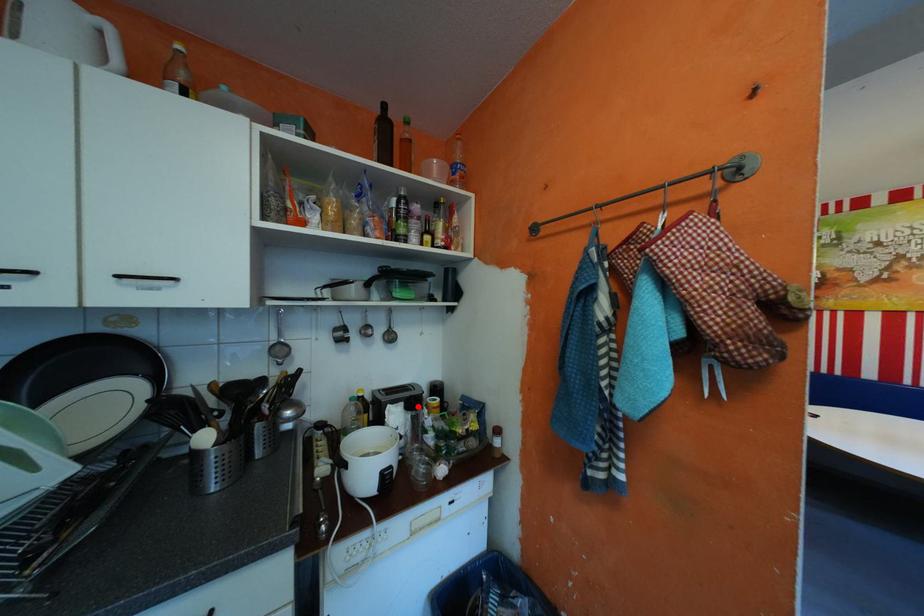
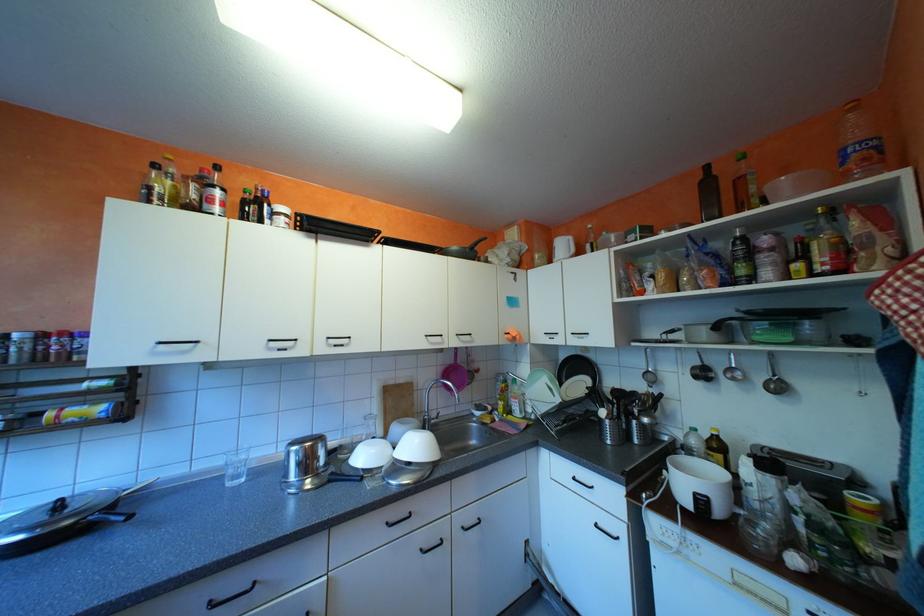
The point at the highlighted location is marked in the first image. Where is the corresponding point in the second image?

(771, 464)